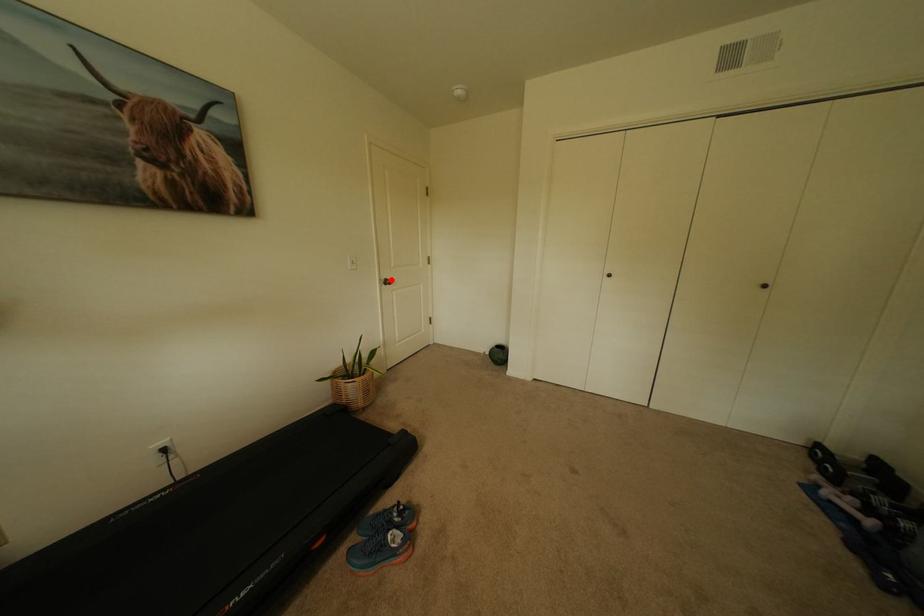
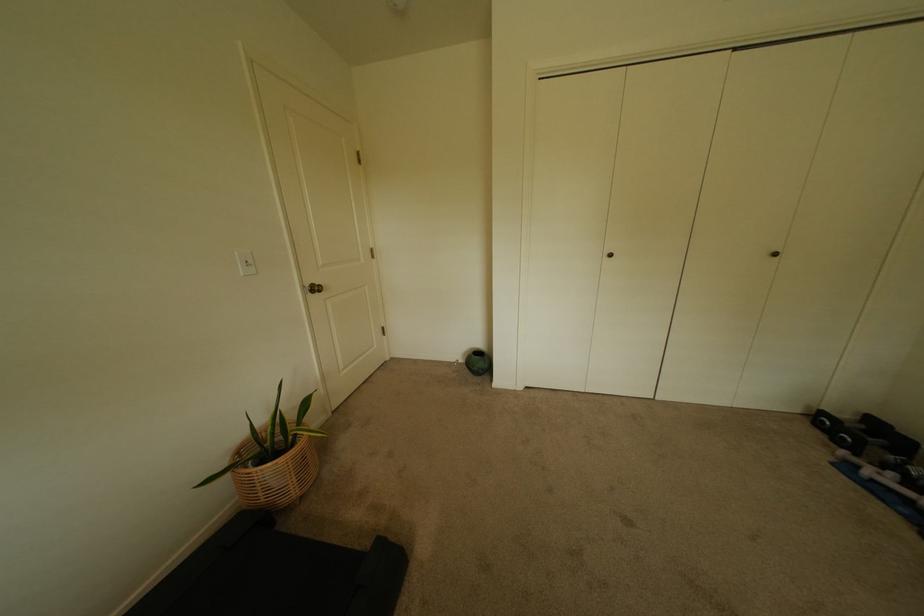
Where in the second image is the point corresponding to the highlighted location from the first image?

(315, 286)